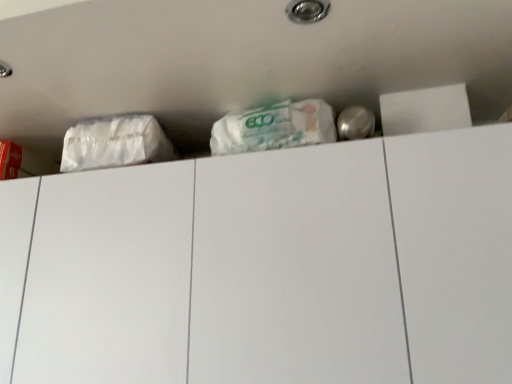
In order to click on white matte drawer at upper center in this screenshot , I will do `click(266, 267)`.

Describe the element at coordinates (266, 267) in the screenshot. I see `white matte drawer at upper center` at that location.

I want to click on white matte plastic bag at upper left, so click(x=115, y=143).

Describe the element at coordinates (115, 143) in the screenshot. The width and height of the screenshot is (512, 384). I see `white matte plastic bag at upper left` at that location.

This screenshot has height=384, width=512. In order to click on white matte drawer at upper center in this screenshot , I will do `click(266, 267)`.

Which object is positioned more to the right, white matte drawer at upper center or white matte plastic bag at upper left?

white matte drawer at upper center.

Is white matte drawer at upper center further to camera compared to white matte plastic bag at upper left?

No, white matte drawer at upper center is closer to the viewer.

Which is less distant, (140, 284) or (70, 157)?

Point (140, 284) is closer to the camera than point (70, 157).

From the image's perspective, which object appears higher, white matte drawer at upper center or white matte plastic bag at upper left?

white matte plastic bag at upper left, from the image's perspective.

From a real-world perspective, is white matte drawer at upper center physically located above or below white matte plastic bag at upper left?

In terms of real-world spatial position, white matte drawer at upper center is below white matte plastic bag at upper left.

Is white matte drawer at upper center wider than white matte plastic bag at upper left?

Yes, white matte drawer at upper center is wider than white matte plastic bag at upper left.

Considering the relative sizes of white matte drawer at upper center and white matte plastic bag at upper left in the image provided, is white matte drawer at upper center taller than white matte plastic bag at upper left?

Correct, white matte drawer at upper center is much taller as white matte plastic bag at upper left.

Which of these two, white matte drawer at upper center or white matte plastic bag at upper left, is smaller?

white matte plastic bag at upper left is smaller.

Is white matte drawer at upper center located outside white matte plastic bag at upper left?

Yes.

Is white matte drawer at upper center next to white matte plastic bag at upper left and touching it?

They are not placed beside each other.

Is white matte drawer at upper center facing towards white matte plastic bag at upper left?

No, white matte drawer at upper center is not turned towards white matte plastic bag at upper left.

This screenshot has height=384, width=512. Find the location of `plastic bag on the left side of white matte drawer at upper center`. plastic bag on the left side of white matte drawer at upper center is located at coordinates (115, 143).

Can you confirm if white matte plastic bag at upper left is positioned to the left of white matte drawer at upper center?

Indeed, white matte plastic bag at upper left is positioned on the left side of white matte drawer at upper center.

Is white matte plastic bag at upper left further to the viewer compared to white matte drawer at upper center?

Yes, the depth of white matte plastic bag at upper left is greater than that of white matte drawer at upper center.

Considering the positions of point (63, 160) and point (51, 303), is point (63, 160) closer or farther from the camera than point (51, 303)?

Clearly, point (63, 160) is more distant from the camera than point (51, 303).

From the image's perspective, which is above, white matte plastic bag at upper left or white matte drawer at upper center?

white matte plastic bag at upper left, from the image's perspective.

From a real-world perspective, is white matte plastic bag at upper left physically located above or below white matte drawer at upper center?

Clearly, from a real-world perspective, white matte plastic bag at upper left is above white matte drawer at upper center.

Between white matte plastic bag at upper left and white matte drawer at upper center, which one has larger width?

white matte drawer at upper center is wider.

Which of these two, white matte plastic bag at upper left or white matte drawer at upper center, stands shorter?

With less height is white matte plastic bag at upper left.

Does white matte plastic bag at upper left have a larger size compared to white matte drawer at upper center?

No, white matte plastic bag at upper left is not bigger than white matte drawer at upper center.

Is white matte plastic bag at upper left completely or partially outside of white matte drawer at upper center?

Yes.

Based on the photo, is white matte plastic bag at upper left next to white matte drawer at upper center and touching it?

They are not placed beside each other.

Is white matte plastic bag at upper left positioned with its back to white matte drawer at upper center?

That's not correct — white matte plastic bag at upper left is not looking away from white matte drawer at upper center.

Measure the distance from white matte plastic bag at upper left to white matte drawer at upper center.

A distance of 12.69 inches exists between white matte plastic bag at upper left and white matte drawer at upper center.

Locate an element on the screen. plastic bag above the white matte drawer at upper center (from the image's perspective) is located at coordinates (115, 143).

The width and height of the screenshot is (512, 384). Find the location of `plastic bag behind the white matte drawer at upper center`. plastic bag behind the white matte drawer at upper center is located at coordinates (115, 143).

The height and width of the screenshot is (384, 512). I want to click on drawer on the right of white matte plastic bag at upper left, so click(266, 267).